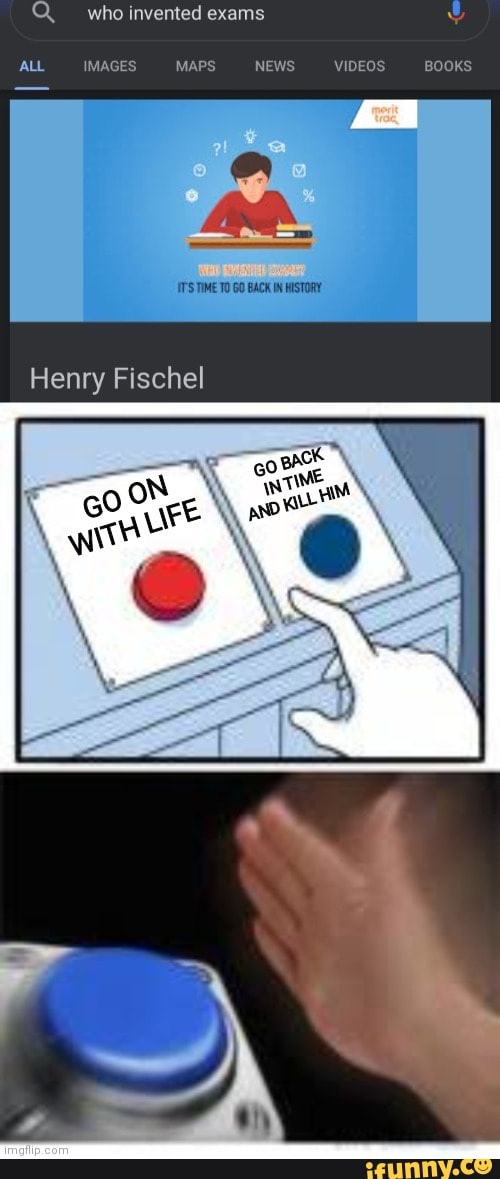
Where is `pen`? pen is located at coordinates (248, 223).